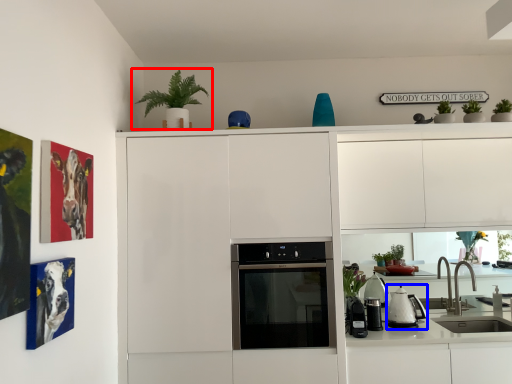
Question: Which object appears farthest to the camera in this image, houseplant (highlighted by a red box) or kitchen appliance (highlighted by a blue box)?

Choices:
 (A) houseplant
 (B) kitchen appliance

Answer: (B)